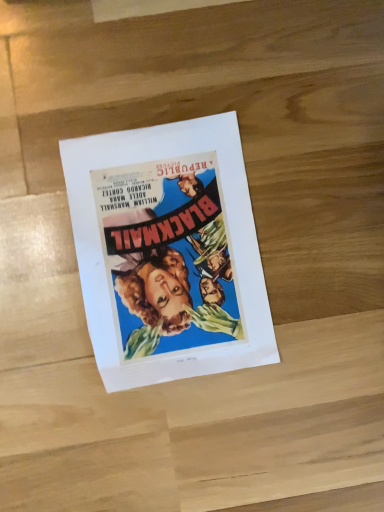
Image resolution: width=384 pixels, height=512 pixels. I want to click on free spot above matte paper poster at center (from a real-world perspective), so click(x=165, y=252).